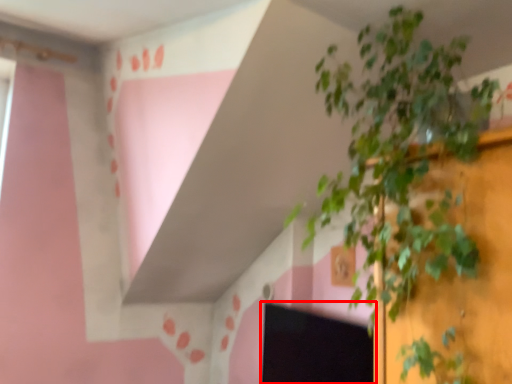
Question: Observing the image, what is the correct spatial positioning of computer screen (annotated by the red box) in reference to houseplant?

Choices:
 (A) right
 (B) left

Answer: (B)